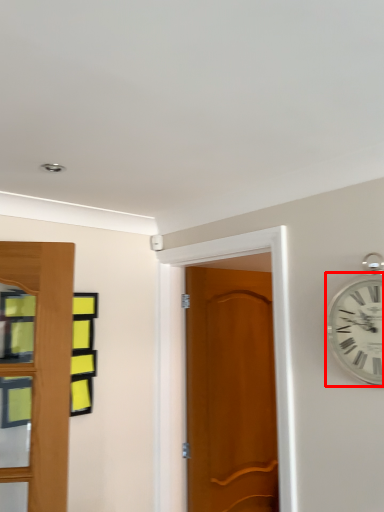
Question: From the image, what is the correct spatial relationship of wall clock (annotated by the red box) in relation to door?

Choices:
 (A) left
 (B) right

Answer: (B)